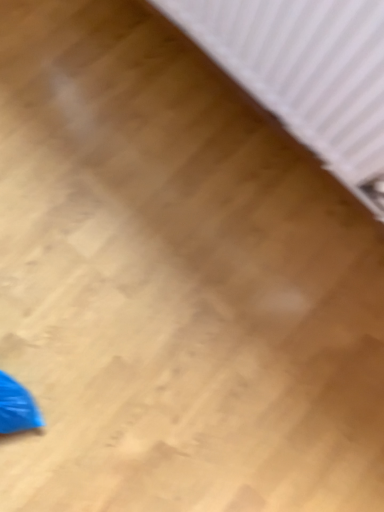
Measure the distance between point (x=369, y=73) and camera.

Point (x=369, y=73) and camera are 24.72 inches apart from each other.

The image size is (384, 512). Describe the element at coordinates (306, 73) in the screenshot. I see `white textured radiator at upper right` at that location.

Where is `white textured radiator at upper right`? white textured radiator at upper right is located at coordinates (306, 73).

Where is `white textured radiator at upper right`? Image resolution: width=384 pixels, height=512 pixels. white textured radiator at upper right is located at coordinates (306, 73).